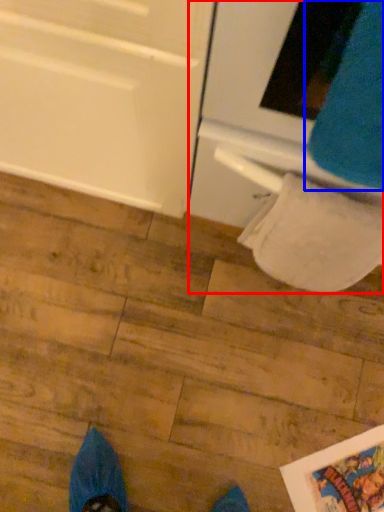
Question: Among these objects, which one is nearest to the camera, oven (highlighted by a red box) or sweat pant (highlighted by a blue box)?

Choices:
 (A) oven
 (B) sweat pant

Answer: (B)